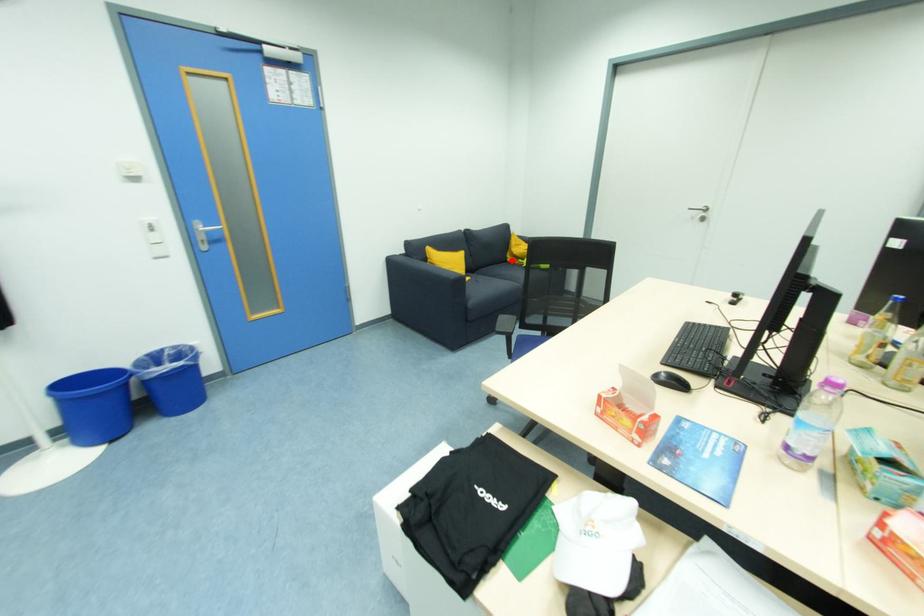
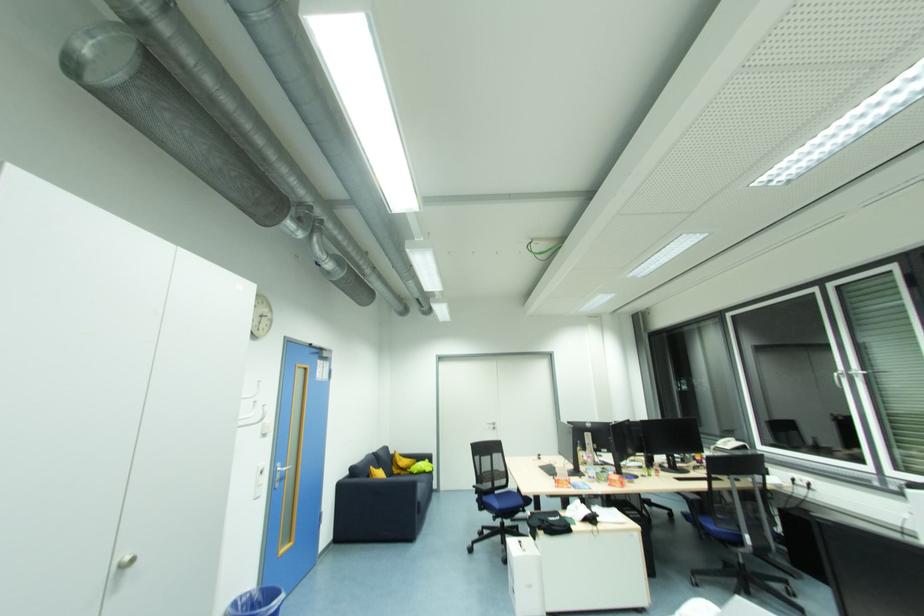
Find the pixel in the second image that matches the highlighted location in the first image.

(398, 472)